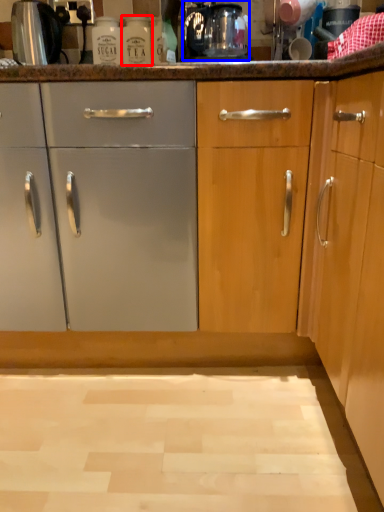
Question: Among these objects, which one is farthest to the camera, bottle (highlighted by a red box) or coffee machine (highlighted by a blue box)?

Choices:
 (A) bottle
 (B) coffee machine

Answer: (A)